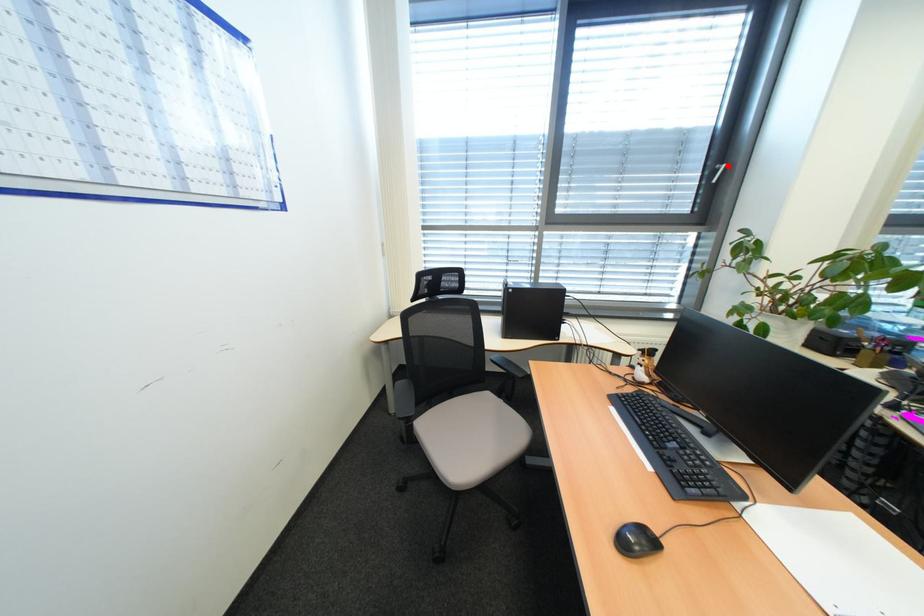
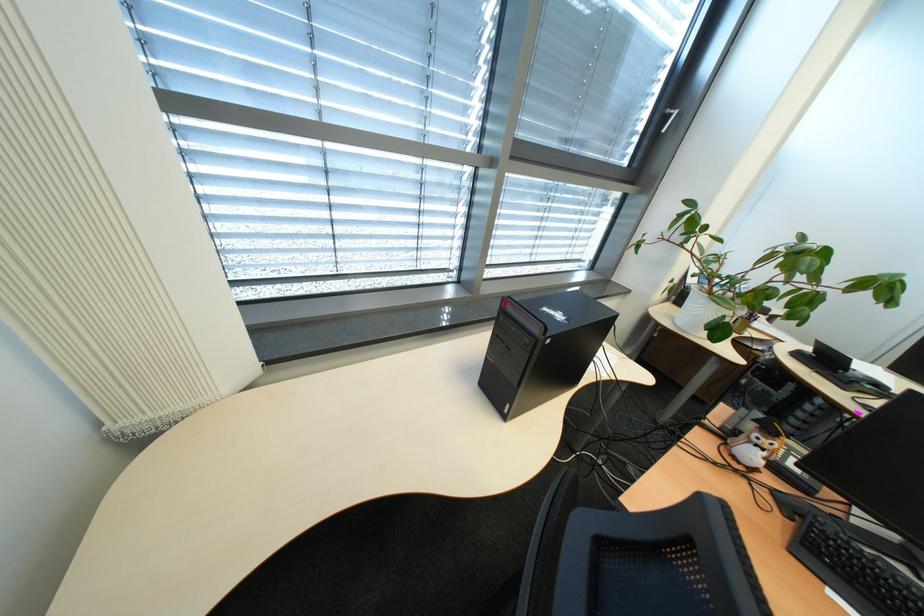
Find the pixel in the second image that matches the highlighted location in the first image.

(678, 110)